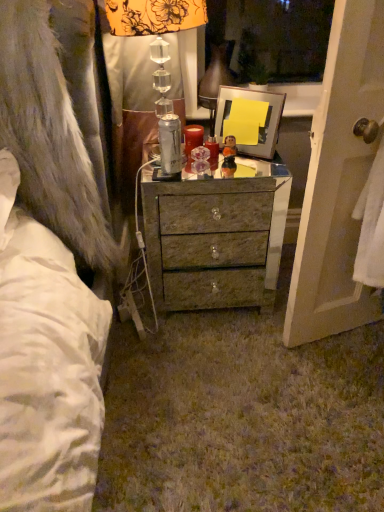
The width and height of the screenshot is (384, 512). Identify the location of matte red candle at center. 193,138.

This screenshot has width=384, height=512. What do you see at coordinates (193, 138) in the screenshot?
I see `matte red candle at center` at bounding box center [193, 138].

Locate an element on the screen. metallic glass lampshade at upper center is located at coordinates (149, 57).

Describe the element at coordinates (48, 133) in the screenshot. The height and width of the screenshot is (512, 384). I see `fuzzy gray fur coat at left` at that location.

Where is `shiny metallic drawer at center`? shiny metallic drawer at center is located at coordinates (216, 237).

Image resolution: width=384 pixels, height=512 pixels. Identify the location of translucent glass figurine at center. (200, 160).

Find the location of a particular element. The height and width of the screenshot is (512, 384). white towel at right is located at coordinates (338, 181).

How many degrees apart are the facing directions of translucent glass figurine at center and metallic silver picture frame at center?

The angle between the facing direction of translucent glass figurine at center and the facing direction of metallic silver picture frame at center is 29.2 degrees.

Could you tell me if translucent glass figurine at center is turned towards metallic silver picture frame at center?

No, translucent glass figurine at center is not oriented towards metallic silver picture frame at center.

Are translucent glass figurine at center and metallic silver picture frame at center making contact?

They are not placed beside each other.

Considering the positions of objects translucent glass figurine at center and metallic silver picture frame at center in the image provided, who is more to the left, translucent glass figurine at center or metallic silver picture frame at center?

Positioned to the left is translucent glass figurine at center.

Considering the sizes of objects white towel at right and matte red candle at center in the image provided, who is bigger, white towel at right or matte red candle at center?

Bigger between the two is white towel at right.

The image size is (384, 512). I want to click on candle that appears on the left of white towel at right, so click(193, 138).

Considering the positions of points (328, 204) and (189, 133), is point (328, 204) closer to camera compared to point (189, 133)?

Yes.

Could you tell me if white towel at right is facing matte red candle at center?

No, white towel at right is not aimed at matte red candle at center.

Is fuzzy gray fur coat at left not within shiny metallic drawer at center?

fuzzy gray fur coat at left is positioned outside shiny metallic drawer at center.

Considering the points (75, 131) and (247, 249), which point is behind, point (75, 131) or point (247, 249)?

The point (247, 249) is behind.

Which of these two, fuzzy gray fur coat at left or shiny metallic drawer at center, is wider?

Wider between the two is fuzzy gray fur coat at left.

I want to click on fur coat above the shiny metallic drawer at center (from a real-world perspective), so click(x=48, y=133).

Can you see shiny metallic drawer at center touching fuzzy gray fur coat at left?

No, shiny metallic drawer at center is not in contact with fuzzy gray fur coat at left.

Considering the positions of objects shiny metallic drawer at center and fuzzy gray fur coat at left in the image provided, who is more to the right, shiny metallic drawer at center or fuzzy gray fur coat at left?

From the viewer's perspective, shiny metallic drawer at center appears more on the right side.

Based on the photo, is shiny metallic drawer at center situated inside fuzzy gray fur coat at left or outside?

shiny metallic drawer at center is spatially situated outside fuzzy gray fur coat at left.

In the scene shown: From a real-world perspective, is shiny metallic drawer at center over white towel at right?

No.

Considering the relative sizes of shiny metallic drawer at center and white towel at right in the image provided, is shiny metallic drawer at center thinner than white towel at right?

No.

Is shiny metallic drawer at center to the left or to the right of white towel at right in the image?

From the image, it's evident that shiny metallic drawer at center is to the left of white towel at right.

Is shiny metallic drawer at center with white towel at right?

No, shiny metallic drawer at center is not touching white towel at right.

From the picture: Considering the relative positions of shiny metallic drawer at center and silver metallic can at center in the image provided, is shiny metallic drawer at center to the right of silver metallic can at center from the viewer's perspective?

Indeed, shiny metallic drawer at center is positioned on the right side of silver metallic can at center.

From the image's perspective, would you say shiny metallic drawer at center is positioned over silver metallic can at center?

No, from the image's perspective, shiny metallic drawer at center is not over silver metallic can at center.

Looking at the image, does shiny metallic drawer at center seem bigger or smaller compared to silver metallic can at center?

Considering their sizes, shiny metallic drawer at center takes up more space than silver metallic can at center.

Locate an element on the screen. The height and width of the screenshot is (512, 384). bottle below the metallic glass lampshade at upper center (from a real-world perspective) is located at coordinates (170, 144).

Are metallic glass lampshade at upper center and silver metallic can at center far apart?

metallic glass lampshade at upper center is actually quite close to silver metallic can at center.

Looking at this image, does metallic glass lampshade at upper center turn towards silver metallic can at center?

Yes, metallic glass lampshade at upper center is turned towards silver metallic can at center.

The image size is (384, 512). I want to click on picture frame in front of the translucent glass figurine at center, so click(x=260, y=128).

The height and width of the screenshot is (512, 384). In the image, there is a white towel at right. What are the coordinates of `candle above it (from the image's perspective)` in the screenshot? It's located at (193, 138).

Estimate the real-world distances between objects in this image. Which object is further from shiny metallic drawer at center, silver metallic can at center or translucent glass figurine at center?

Among the two, silver metallic can at center is located further to shiny metallic drawer at center.

Based on the photo, looking at the image, which one is located further to metallic glass lampshade at upper center, metallic silver picture frame at center or fuzzy gray fur coat at left?

The object further to metallic glass lampshade at upper center is fuzzy gray fur coat at left.

Looking at the image, which one is located closer to metallic glass lampshade at upper center, shiny metallic drawer at center or translucent glass figurine at center?

translucent glass figurine at center is positioned closer to the anchor metallic glass lampshade at upper center.

When comparing their distances from silver metallic can at center, does matte red candle at center or metallic silver picture frame at center seem closer?

matte red candle at center is closer to silver metallic can at center.

Looking at the image, which one is located further to translucent glass figurine at center, fuzzy gray fur coat at left or silver metallic can at center?

fuzzy gray fur coat at left.

From the image, which object appears to be farther from matte red candle at center, fuzzy gray fur coat at left or shiny metallic drawer at center?

Among the two, fuzzy gray fur coat at left is located further to matte red candle at center.

Based on their spatial positions, is shiny metallic drawer at center or white towel at right closer to fuzzy gray fur coat at left?

shiny metallic drawer at center.

Based on their spatial positions, is translucent glass figurine at center or silver metallic can at center closer to fuzzy gray fur coat at left?

silver metallic can at center lies closer to fuzzy gray fur coat at left than the other object.

This screenshot has height=512, width=384. In order to click on desk situated between metallic glass lampshade at upper center and white towel at right from left to right in this screenshot , I will do `click(216, 237)`.

Identify the location of picture frame that lies between metallic glass lampshade at upper center and shiny metallic drawer at center from top to bottom. (260, 128).

Image resolution: width=384 pixels, height=512 pixels. I want to click on picture frame between metallic glass lampshade at upper center and translucent glass figurine at center in the front-back direction, so click(x=260, y=128).

Locate an element on the screen. candle situated between fuzzy gray fur coat at left and white towel at right from left to right is located at coordinates (193, 138).